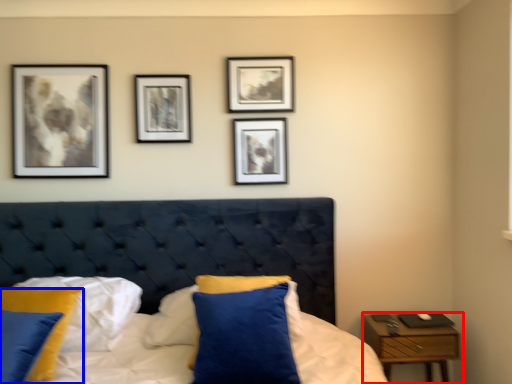
Question: Which of the following is the farthest to the observer, nightstand (highlighted by a red box) or pillow (highlighted by a blue box)?

Choices:
 (A) nightstand
 (B) pillow

Answer: (A)